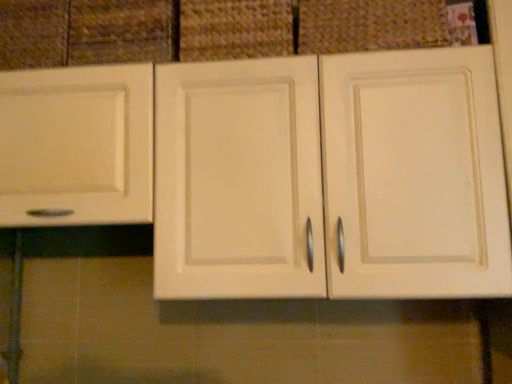
Identify the location of matte cream cabinet at center. This screenshot has height=384, width=512. (274, 169).

What do you see at coordinates (371, 25) in the screenshot? The height and width of the screenshot is (384, 512). I see `matte fabric basket at upper center, which is the second basket in left-to-right order` at bounding box center [371, 25].

Find the location of `woven fabric basket at upper center, which is counted as the second basket, starting from the right`. woven fabric basket at upper center, which is counted as the second basket, starting from the right is located at coordinates click(x=234, y=29).

What's the angular difference between woven fabric basket at upper center, the first basket when ordered from left to right, and matte fabric basket at upper center, which appears as the 1th basket when viewed from the right,'s facing directions?

The facing directions of woven fabric basket at upper center, the first basket when ordered from left to right, and matte fabric basket at upper center, which appears as the 1th basket when viewed from the right, are 1.92 degrees apart.

Is woven fabric basket at upper center, which is counted as the second basket, starting from the right, thinner than matte fabric basket at upper center, which appears as the 1th basket when viewed from the right?

Incorrect, the width of woven fabric basket at upper center, which is counted as the second basket, starting from the right, is not less than that of matte fabric basket at upper center, which appears as the 1th basket when viewed from the right.

Considering the positions of objects woven fabric basket at upper center, which is counted as the second basket, starting from the right, and matte fabric basket at upper center, which is the second basket in left-to-right order, in the image provided, who is more to the right, woven fabric basket at upper center, which is counted as the second basket, starting from the right, or matte fabric basket at upper center, which is the second basket in left-to-right order,?

matte fabric basket at upper center, which is the second basket in left-to-right order, is more to the right.

Is woven fabric basket at upper center, the first basket when ordered from left to right, turned away from matte fabric basket at upper center, which appears as the 1th basket when viewed from the right?

No, woven fabric basket at upper center, the first basket when ordered from left to right, is not facing away from matte fabric basket at upper center, which appears as the 1th basket when viewed from the right.

Locate an element on the screen. Image resolution: width=512 pixels, height=384 pixels. cabinetry in front of the woven fabric basket at upper center, the first basket when ordered from left to right is located at coordinates (274, 169).

Could you tell me if matte cream cabinet at center is facing woven fabric basket at upper center, which is counted as the second basket, starting from the right?

No, matte cream cabinet at center is not oriented towards woven fabric basket at upper center, which is counted as the second basket, starting from the right.

Is point (279, 216) positioned after point (188, 40)?

No.

Is the surface of matte cream cabinet at center in direct contact with woven fabric basket at upper center, the first basket when ordered from left to right?

No.

From a real-world perspective, is matte white drawer at upper left located beneath matte cream cabinet at center?

No.

Does matte white drawer at upper left have a lesser height compared to matte cream cabinet at center?

Yes, matte white drawer at upper left is shorter than matte cream cabinet at center.

Does matte white drawer at upper left turn towards matte cream cabinet at center?

Yes.

Between matte white drawer at upper left and matte cream cabinet at center, which one is positioned in front?

matte cream cabinet at center is in front.

Visually, is matte cream cabinet at center positioned to the left or to the right of matte white drawer at upper left?

From the image, it's evident that matte cream cabinet at center is to the right of matte white drawer at upper left.

How distant is matte cream cabinet at center from matte white drawer at upper left?

The distance of matte cream cabinet at center from matte white drawer at upper left is 13.42 inches.

Where is `drawer behind the matte cream cabinet at center`? drawer behind the matte cream cabinet at center is located at coordinates (120, 31).

Is matte cream cabinet at center positioned with its back to matte white drawer at upper left?

No, matte cream cabinet at center is not facing away from matte white drawer at upper left.

Is there a large distance between matte white drawer at upper left and matte fabric basket at upper center, which appears as the 1th basket when viewed from the right?

matte white drawer at upper left is actually quite close to matte fabric basket at upper center, which appears as the 1th basket when viewed from the right.

How different are the orientations of matte white drawer at upper left and matte fabric basket at upper center, which is the second basket in left-to-right order, in degrees?

The angular difference between matte white drawer at upper left and matte fabric basket at upper center, which is the second basket in left-to-right order, is 6.16 degrees.

Considering the relative positions of matte white drawer at upper left and matte fabric basket at upper center, which appears as the 1th basket when viewed from the right, in the image provided, is matte white drawer at upper left to the left or to the right of matte fabric basket at upper center, which appears as the 1th basket when viewed from the right,?

Clearly, matte white drawer at upper left is on the left of matte fabric basket at upper center, which appears as the 1th basket when viewed from the right, in the image.

Which is nearer, (130, 49) or (340, 2)?

Point (130, 49) appears to be farther away from the viewer than point (340, 2).

How distant is woven fabric basket at upper center, which is counted as the second basket, starting from the right, from matte white drawer at upper left?

woven fabric basket at upper center, which is counted as the second basket, starting from the right, and matte white drawer at upper left are 6.49 inches apart.

Are woven fabric basket at upper center, which is counted as the second basket, starting from the right, and matte white drawer at upper left far apart?

woven fabric basket at upper center, which is counted as the second basket, starting from the right, is actually quite close to matte white drawer at upper left.

Would you say woven fabric basket at upper center, which is counted as the second basket, starting from the right, is outside matte white drawer at upper left?

Yes, woven fabric basket at upper center, which is counted as the second basket, starting from the right, is outside of matte white drawer at upper left.

Which object is positioned more to the left, matte white drawer at upper left or woven fabric basket at upper center, which is counted as the second basket, starting from the right?

Positioned to the left is matte white drawer at upper left.

Image resolution: width=512 pixels, height=384 pixels. Identify the location of basket that is the 1st one below the matte white drawer at upper left (from a real-world perspective). (234, 29).

From the image's perspective, which one is positioned lower, matte white drawer at upper left or woven fabric basket at upper center, which is counted as the second basket, starting from the right?

From the image's view, matte white drawer at upper left is below.

Is matte white drawer at upper left taller or shorter than woven fabric basket at upper center, which is counted as the second basket, starting from the right?

Clearly, matte white drawer at upper left is taller compared to woven fabric basket at upper center, which is counted as the second basket, starting from the right.

Where is `basket in front of the woven fabric basket at upper center, which is counted as the second basket, starting from the right`? basket in front of the woven fabric basket at upper center, which is counted as the second basket, starting from the right is located at coordinates (371, 25).

Where is `the 2nd basket behind the matte cream cabinet at center, counting from the anchor's position`? Image resolution: width=512 pixels, height=384 pixels. the 2nd basket behind the matte cream cabinet at center, counting from the anchor's position is located at coordinates (234, 29).

Considering their positions, is matte white drawer at upper left positioned closer to matte cream cabinet at center than matte fabric basket at upper center, which appears as the 1th basket when viewed from the right?

matte fabric basket at upper center, which appears as the 1th basket when viewed from the right.

Considering their positions, is matte white drawer at upper left positioned closer to woven fabric basket at upper center, which is counted as the second basket, starting from the right, than matte fabric basket at upper center, which appears as the 1th basket when viewed from the right?

matte white drawer at upper left is closer to woven fabric basket at upper center, which is counted as the second basket, starting from the right.

When comparing their distances from woven fabric basket at upper center, the first basket when ordered from left to right, does matte white drawer at upper left or matte cream cabinet at center seem closer?

Based on the image, matte white drawer at upper left appears to be nearer to woven fabric basket at upper center, the first basket when ordered from left to right.

Estimate the real-world distances between objects in this image. Which object is closer to matte white drawer at upper left, matte cream cabinet at center or matte fabric basket at upper center, which is the second basket in left-to-right order?

Among the two, matte cream cabinet at center is located nearer to matte white drawer at upper left.

Looking at the image, which one is located further to matte white drawer at upper left, matte fabric basket at upper center, which appears as the 1th basket when viewed from the right, or matte cream cabinet at center?

matte fabric basket at upper center, which appears as the 1th basket when viewed from the right, is positioned further to the anchor matte white drawer at upper left.

Estimate the real-world distances between objects in this image. Which object is closer to matte cream cabinet at center, matte fabric basket at upper center, which is the second basket in left-to-right order, or matte white drawer at upper left?

matte fabric basket at upper center, which is the second basket in left-to-right order.

From the image, which object appears to be farther from matte cream cabinet at center, woven fabric basket at upper center, the first basket when ordered from left to right, or matte fabric basket at upper center, which is the second basket in left-to-right order?

Based on the image, matte fabric basket at upper center, which is the second basket in left-to-right order, appears to be further to matte cream cabinet at center.

Based on their spatial positions, is matte white drawer at upper left or matte cream cabinet at center closer to matte fabric basket at upper center, which appears as the 1th basket when viewed from the right?

matte cream cabinet at center lies closer to matte fabric basket at upper center, which appears as the 1th basket when viewed from the right, than the other object.

Find the location of a particular element. The height and width of the screenshot is (384, 512). drawer between woven fabric basket at upper center, the first basket when ordered from left to right, and matte cream cabinet at center in the up-down direction is located at coordinates (120, 31).

The image size is (512, 384). In order to click on basket between matte fabric basket at upper center, which is the second basket in left-to-right order, and matte cream cabinet at center in the up-down direction in this screenshot , I will do `click(234, 29)`.

At what (x,y) coordinates should I click in order to perform the action: click on cabinetry between matte white drawer at upper left and matte fabric basket at upper center, which is the second basket in left-to-right order, from left to right. Please return your answer as a coordinate pair (x, y). The width and height of the screenshot is (512, 384). Looking at the image, I should click on (274, 169).

Identify the location of basket between matte white drawer at upper left and matte fabric basket at upper center, which is the second basket in left-to-right order, in the horizontal direction. (234, 29).